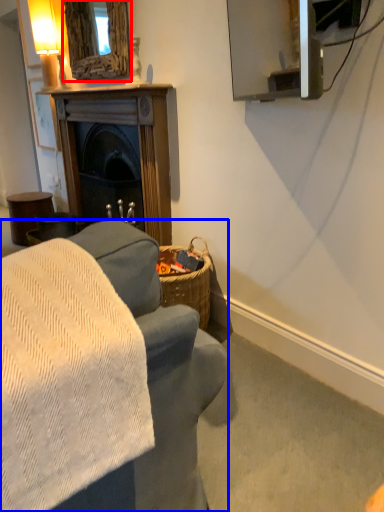
Question: Among these objects, which one is nearest to the camera, mirror (highlighted by a red box) or studio couch (highlighted by a blue box)?

Choices:
 (A) mirror
 (B) studio couch

Answer: (B)